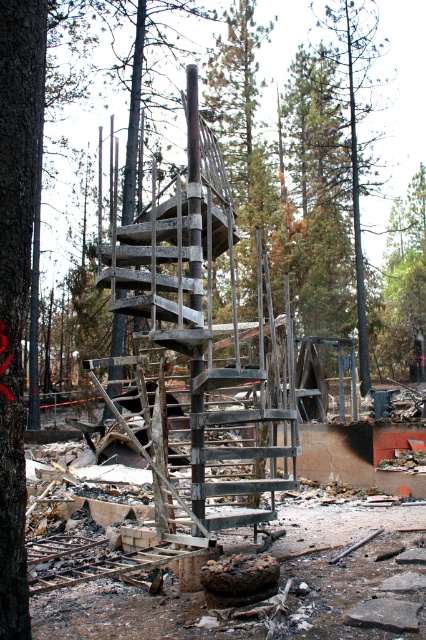
Question: Is charred wood spiral staircase at center positioned at the back of green pine tree at center?

Choices:
 (A) yes
 (B) no

Answer: (B)

Question: Which of the following is the farthest from the observer?

Choices:
 (A) dark brown bark tree at center
 (B) charred wood spiral staircase at center

Answer: (B)

Question: Which object is closer to the camera taking this photo?

Choices:
 (A) green pine tree at center
 (B) dark brown bark tree at center

Answer: (B)

Question: Estimate the real-world distances between objects in this image. Which object is closer to the charred wood spiral staircase at center?

Choices:
 (A) dark brown bark tree at center
 (B) green pine tree at center

Answer: (A)

Question: Where is charred wood spiral staircase at center located in relation to dark brown bark tree at center in the image?

Choices:
 (A) left
 (B) right

Answer: (B)

Question: Does charred wood spiral staircase at center appear on the right side of dark brown bark tree at center?

Choices:
 (A) no
 (B) yes

Answer: (B)